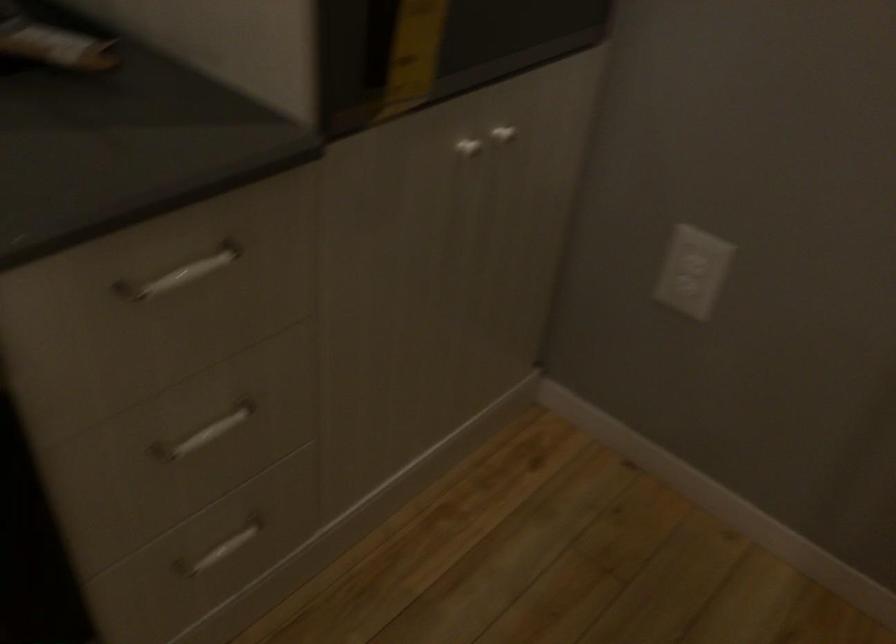
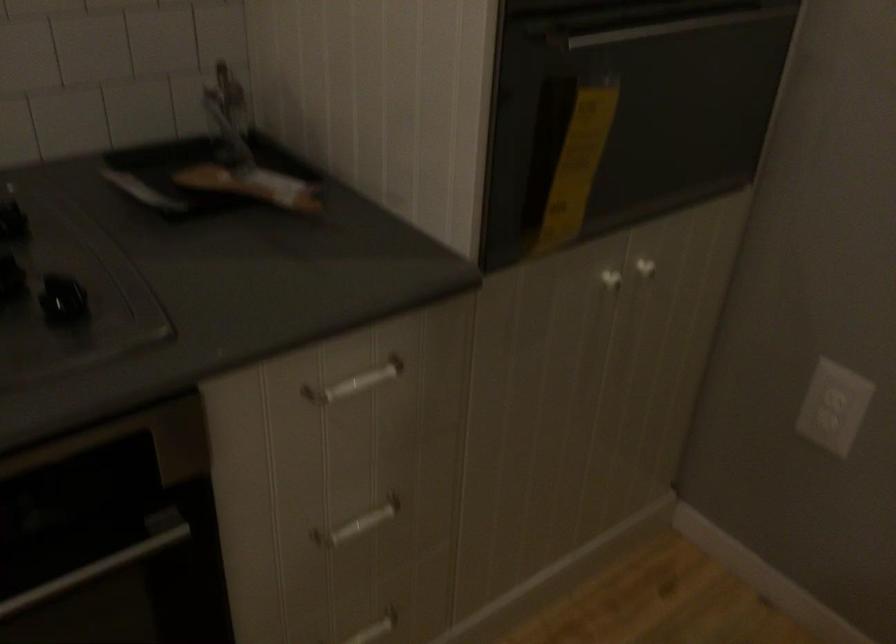
In the second image, find the point that corresponds to point 210,433 in the first image.

(358, 524)